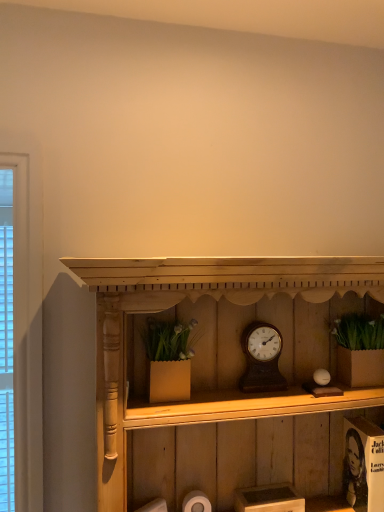
Question: Is there a large distance between wooden shelf at center and wooden clock at center?

Choices:
 (A) yes
 (B) no

Answer: (B)

Question: Is wooden clock at center located within wooden shelf at center?

Choices:
 (A) yes
 (B) no

Answer: (A)

Question: Does wooden shelf at center appear on the right side of wooden clock at center?

Choices:
 (A) yes
 (B) no

Answer: (B)

Question: Does wooden shelf at center come in front of wooden clock at center?

Choices:
 (A) yes
 (B) no

Answer: (A)

Question: Considering the relative sizes of wooden shelf at center and wooden clock at center in the image provided, is wooden shelf at center bigger than wooden clock at center?

Choices:
 (A) no
 (B) yes

Answer: (B)

Question: Considering the positions of wooden shelf at center and white matte toilet paper at lower center in the image, is wooden shelf at center bigger or smaller than white matte toilet paper at lower center?

Choices:
 (A) small
 (B) big

Answer: (B)

Question: Is wooden shelf at center spatially inside white matte toilet paper at lower center, or outside of it?

Choices:
 (A) inside
 (B) outside

Answer: (B)

Question: From a real-world perspective, is wooden shelf at center above or below white matte toilet paper at lower center?

Choices:
 (A) below
 (B) above

Answer: (B)

Question: Considering the positions of wooden shelf at center and white matte toilet paper at lower center in the image, is wooden shelf at center wider or thinner than white matte toilet paper at lower center?

Choices:
 (A) wide
 (B) thin

Answer: (A)

Question: Relative to white matte toilet paper at lower center, is wooden clock at center in front or behind?

Choices:
 (A) front
 (B) behind

Answer: (B)

Question: Considering the relative positions of wooden clock at center and white matte toilet paper at lower center in the image provided, is wooden clock at center to the left or to the right of white matte toilet paper at lower center?

Choices:
 (A) right
 (B) left

Answer: (A)

Question: From the image's perspective, is wooden clock at center located above or below white matte toilet paper at lower center?

Choices:
 (A) above
 (B) below

Answer: (A)

Question: From a real-world perspective, relative to white matte toilet paper at lower center, is wooden clock at center vertically above or below?

Choices:
 (A) below
 (B) above

Answer: (B)

Question: From the image's perspective, is wooden shelf at center located above or below wooden clock at center?

Choices:
 (A) above
 (B) below

Answer: (B)

Question: Is wooden shelf at center taller or shorter than wooden clock at center?

Choices:
 (A) tall
 (B) short

Answer: (A)